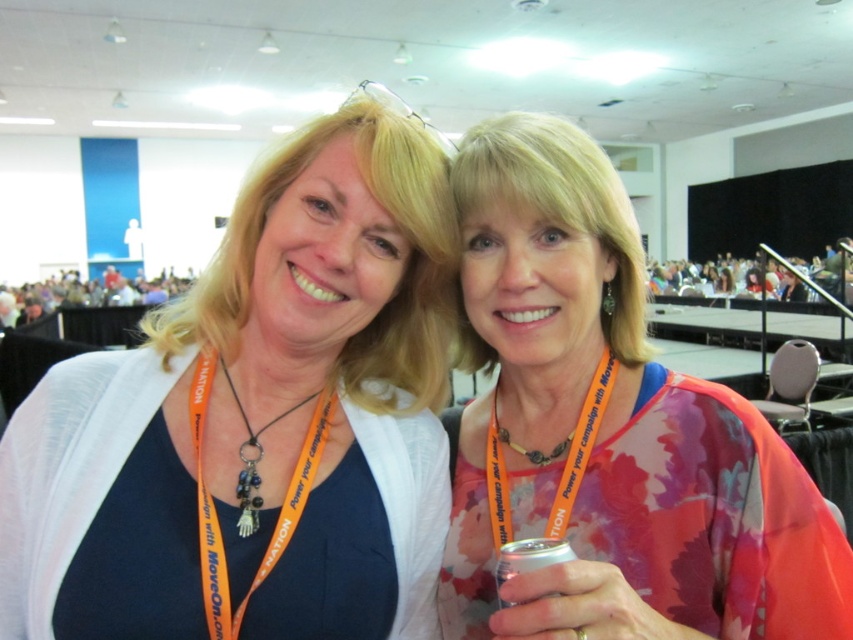
Question: Which of the following is the farthest from the observer?

Choices:
 (A) white fabric shirt at center
 (B) floral silk blouse at center
 (C) orange fabric lanyard at center

Answer: (C)

Question: Which of the following is the farthest from the observer?

Choices:
 (A) white fabric shirt at center
 (B) orange fabric lanyard at center

Answer: (B)

Question: Which of the following is the closest to the observer?

Choices:
 (A) (703, 628)
 (B) (286, 410)
 (C) (561, 550)

Answer: (C)

Question: Considering the relative positions of white fabric shirt at center and silver metallic can at lower center in the image provided, where is white fabric shirt at center located with respect to silver metallic can at lower center?

Choices:
 (A) below
 (B) above

Answer: (B)

Question: In this image, where is floral silk blouse at center located relative to silver metallic can at lower center?

Choices:
 (A) left
 (B) right

Answer: (B)

Question: Can you confirm if white fabric shirt at center is thinner than floral silk blouse at center?

Choices:
 (A) no
 (B) yes

Answer: (A)